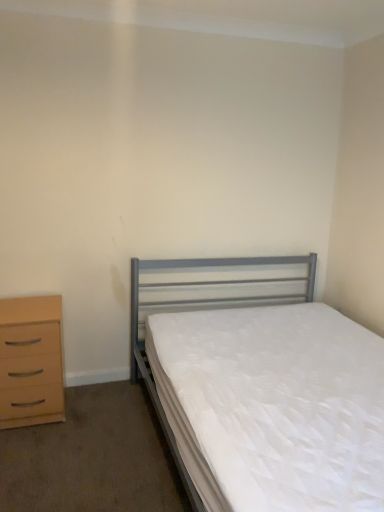
Find the location of a particular element. free location in front of light wood/texture chest of drawers at left is located at coordinates (34, 448).